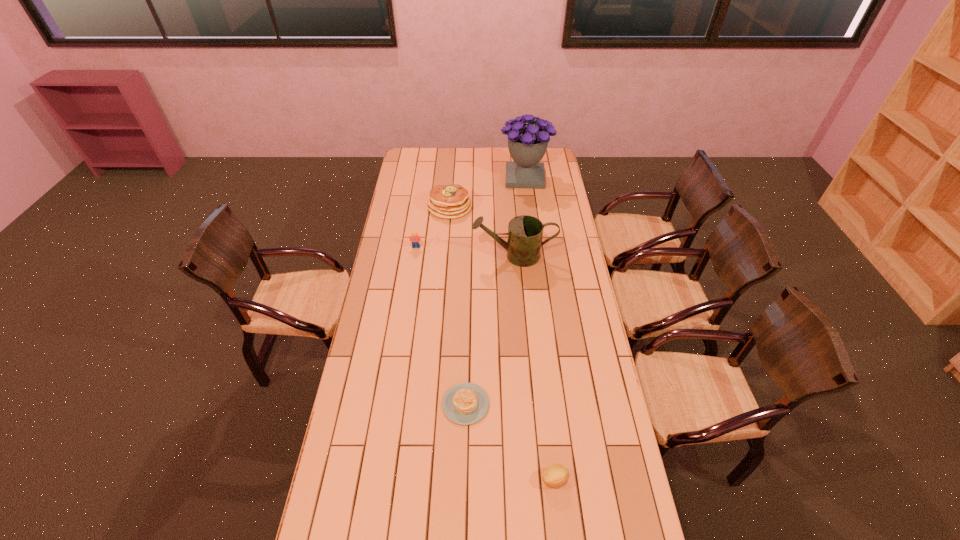
Identify the location of object that is the second closest to the Lego. The width and height of the screenshot is (960, 540). (525, 232).

The width and height of the screenshot is (960, 540). I want to click on free region that satisfies the following two spatial constraints: 1. on the face of the fourth tallest object; 2. on the right side of the nearer pancake, so click(x=393, y=404).

Image resolution: width=960 pixels, height=540 pixels. In order to click on vacant space that satisfies the following two spatial constraints: 1. on the face of the second nearest object; 2. on the right side of the third shortest object in this screenshot , I will do `click(393, 404)`.